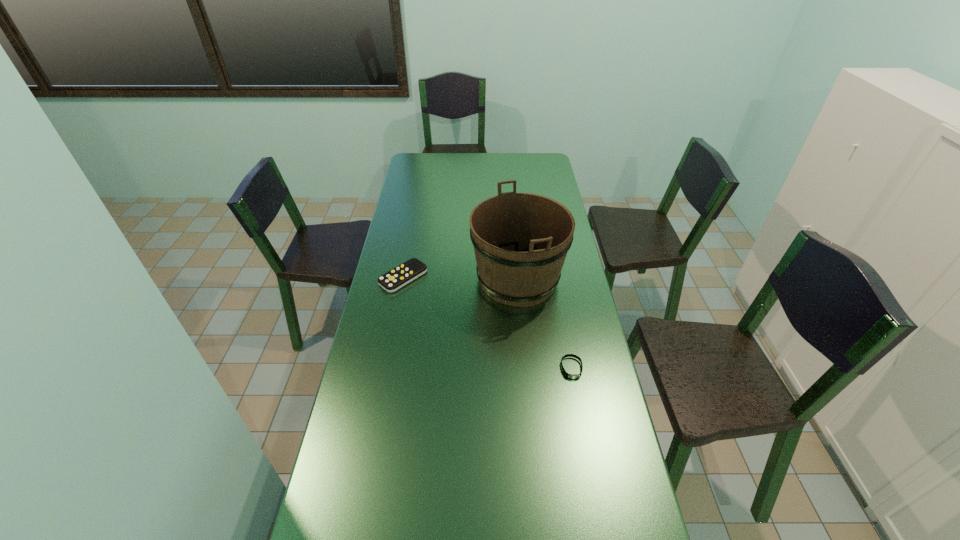
Find the location of `object identified as the second closest to the tallest object`. object identified as the second closest to the tallest object is located at coordinates (573, 376).